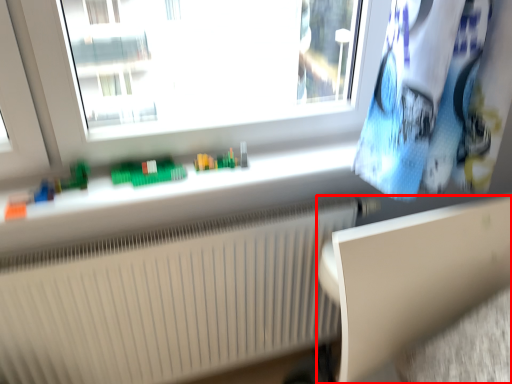
Question: In this image, where is table (annotated by the red box) located relative to radiator?

Choices:
 (A) left
 (B) right

Answer: (B)